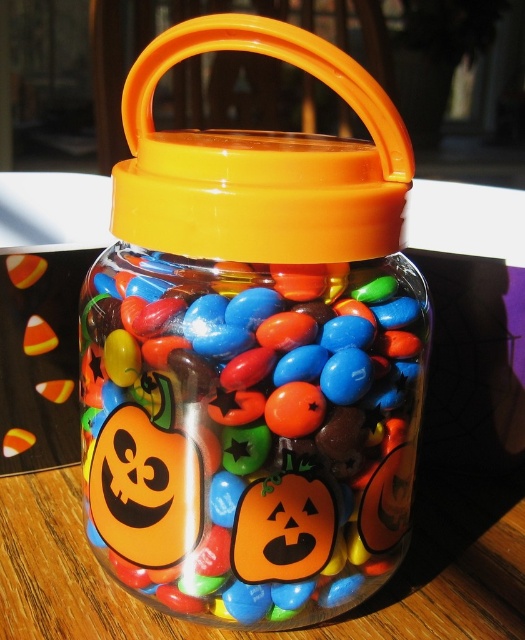
Question: Can you confirm if glossy plastic jar at center is positioned above orange plastic handle at upper center?

Choices:
 (A) yes
 (B) no

Answer: (B)

Question: Which object is closer to the camera taking this photo?

Choices:
 (A) glossy plastic jar at center
 (B) orange plastic handle at upper center

Answer: (B)

Question: Does glossy plastic jar at center come in front of orange plastic handle at upper center?

Choices:
 (A) yes
 (B) no

Answer: (B)

Question: Which point is farther to the camera?

Choices:
 (A) orange plastic handle at upper center
 (B) glossy plastic jar at center

Answer: (B)

Question: Is glossy plastic jar at center further to camera compared to orange plastic handle at upper center?

Choices:
 (A) no
 (B) yes

Answer: (B)